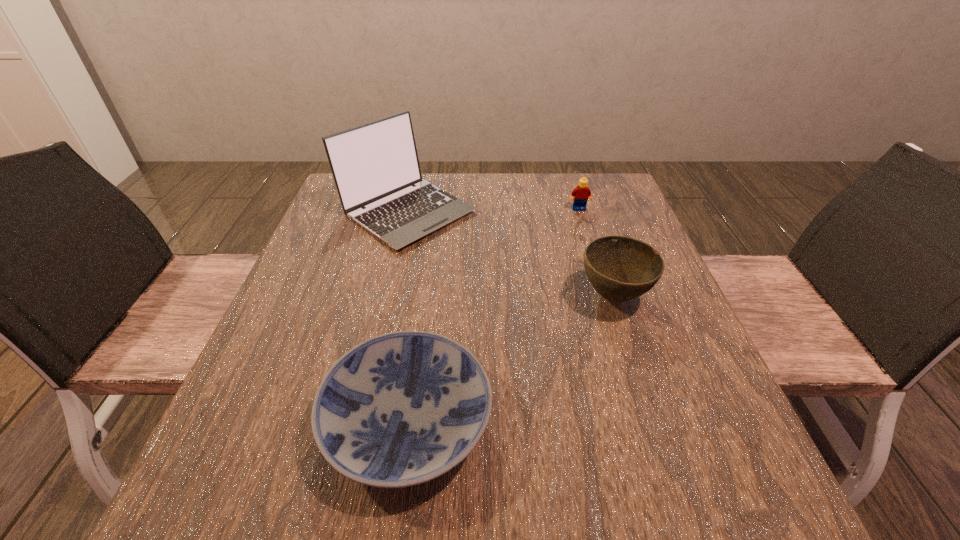
The image size is (960, 540). I want to click on unoccupied position between the bowl and the nearest object, so click(x=511, y=359).

Identify the location of unoccupied area between the tallest object and the second nearest object. Image resolution: width=960 pixels, height=540 pixels. (511, 254).

This screenshot has width=960, height=540. I want to click on vacant point located between the shortest object and the Lego, so click(493, 315).

Find the location of a particular element. free space between the laptop_computer and the Lego is located at coordinates (493, 210).

Identify the location of vacant area that lies between the Lego and the laptop_computer. (493, 210).

Select which object is the closest to the laptop_computer. Please provide its 2D coordinates. Your answer should be formatted as a tuple, i.e. [(x, y)], where the tuple contains the x and y coordinates of a point satisfying the conditions above.

[(620, 268)]

Identify which object is the second closest to the Lego. Please provide its 2D coordinates. Your answer should be formatted as a tuple, i.e. [(x, y)], where the tuple contains the x and y coordinates of a point satisfying the conditions above.

[(620, 268)]

Identify the location of vacant space that satisfies the following two spatial constraints: 1. on the back side of the plate; 2. on the left side of the bowl. The height and width of the screenshot is (540, 960). (425, 296).

This screenshot has height=540, width=960. I want to click on vacant region that satisfies the following two spatial constraints: 1. at the front screen of the tallest object; 2. on the left side of the third farthest object, so click(388, 296).

The image size is (960, 540). I want to click on vacant area that satisfies the following two spatial constraints: 1. at the front screen of the shortest object; 2. on the right side of the tallest object, so click(x=360, y=422).